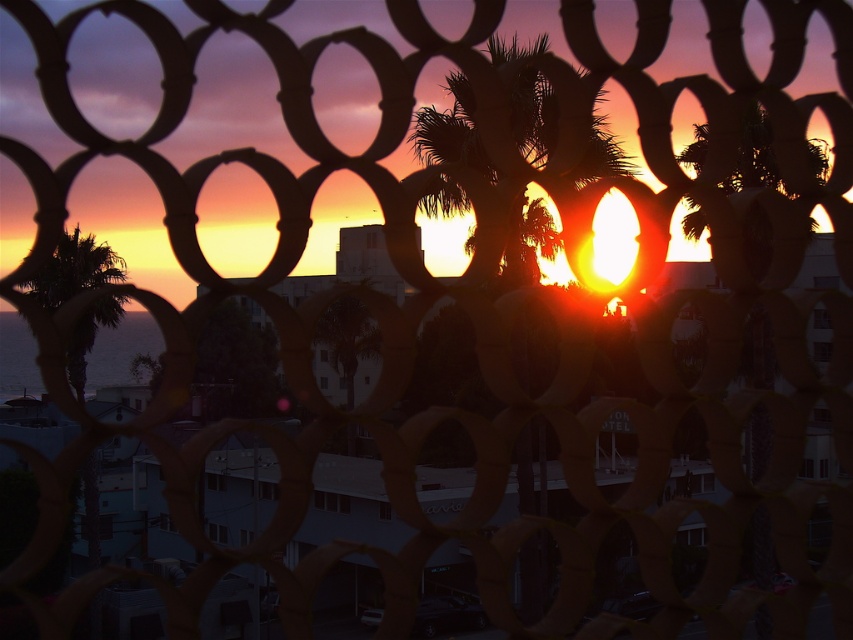
Locate an element on the screen. The width and height of the screenshot is (853, 640). green leafy palm tree at left is located at coordinates (73, 269).

Based on the photo, who is positioned more to the left, green leafy palm tree at left or dark blue water at lower left?

Positioned to the left is dark blue water at lower left.

Which is behind, point (83, 336) or point (15, 346)?

Point (15, 346)

Locate an element on the screen. The image size is (853, 640). green leafy palm tree at left is located at coordinates (73, 269).

Does silhouette leafy palm at center have a lesser width compared to green leafy palm tree at left?

Indeed, silhouette leafy palm at center has a lesser width compared to green leafy palm tree at left.

Is silhouette leafy palm at center wider than green leafy palm tree at left?

No, silhouette leafy palm at center is not wider than green leafy palm tree at left.

Does point (485, 170) come behind point (62, 257)?

No.

The width and height of the screenshot is (853, 640). Identify the location of silhouette leafy palm at center. (451, 131).

In the scene shown: Can you confirm if silhouette leafy palm at center is thinner than dark blue water at lower left?

Correct, silhouette leafy palm at center's width is less than dark blue water at lower left's.

Is silhouette leafy palm at center shorter than dark blue water at lower left?

Yes, silhouette leafy palm at center is shorter than dark blue water at lower left.

Is point (519, 116) behind point (12, 346)?

No, it is not.

The height and width of the screenshot is (640, 853). Identify the location of silhouette leafy palm at center. [451, 131].